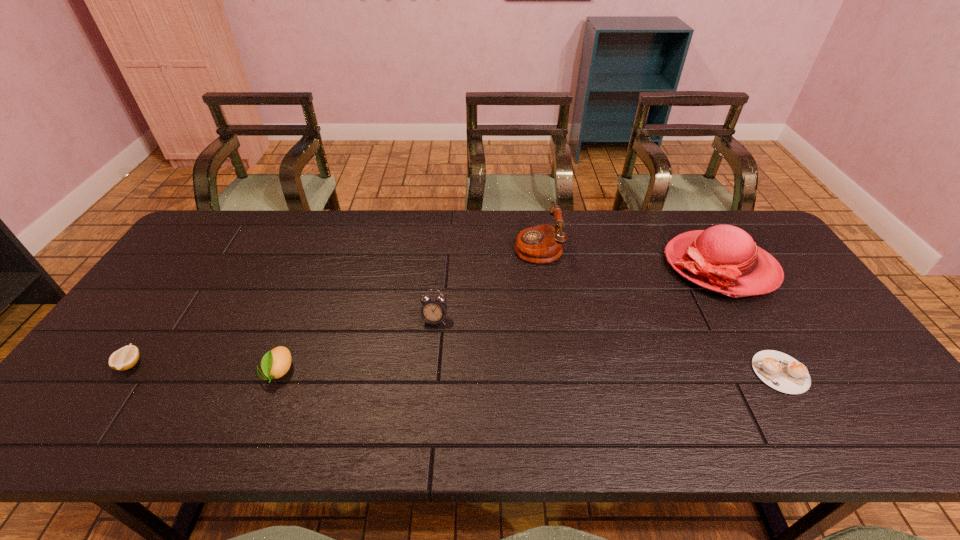
Where is `the fourth object from left to right`? This screenshot has height=540, width=960. the fourth object from left to right is located at coordinates (541, 244).

I want to click on hat, so click(723, 258).

Locate an element on the screen. This screenshot has width=960, height=540. the third farthest object is located at coordinates (433, 311).

Find the location of a particular element. The image size is (960, 540). alarm clock is located at coordinates (433, 311).

At what (x,y) coordinates should I click in order to perform the action: click on the second object from left to right. Please return your answer as a coordinate pair (x, y). The image size is (960, 540). Looking at the image, I should click on (275, 363).

This screenshot has height=540, width=960. Identify the location of the third shortest object. (275, 363).

The image size is (960, 540). Identify the location of the left lemon. (126, 357).

This screenshot has width=960, height=540. In order to click on the shorter lemon in this screenshot , I will do `click(126, 357)`.

Locate an element on the screen. cappuccino is located at coordinates (778, 370).

The height and width of the screenshot is (540, 960). I want to click on vacant space located 0.250m on the dial of the third object from right to left, so click(x=437, y=246).